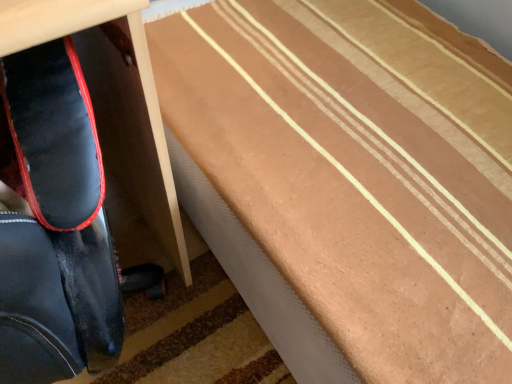
The height and width of the screenshot is (384, 512). What do you see at coordinates (62, 195) in the screenshot?
I see `black leather chair at lower left` at bounding box center [62, 195].

The width and height of the screenshot is (512, 384). I want to click on black leather chair at lower left, so click(62, 195).

Find the location of a particular element. The image size is (512, 384). black leather chair at lower left is located at coordinates (62, 195).